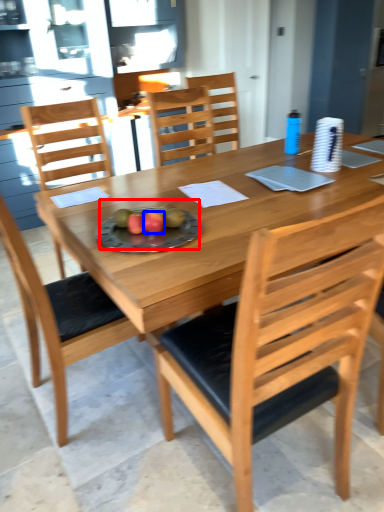
Question: Among these objects, which one is nearest to the camera, fruit dish (highlighted by a red box) or fruit (highlighted by a blue box)?

Choices:
 (A) fruit dish
 (B) fruit

Answer: (A)